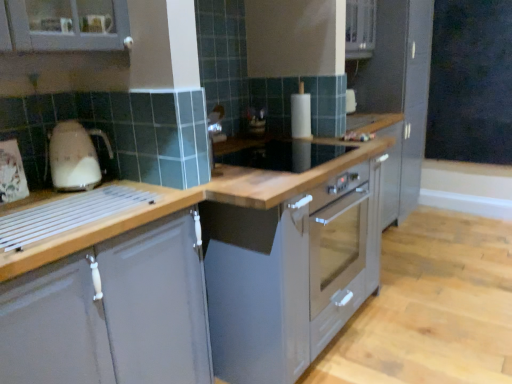
The image size is (512, 384). In order to click on vacant area that lies to the right of white paper towel holder at center in this screenshot , I will do `click(325, 136)`.